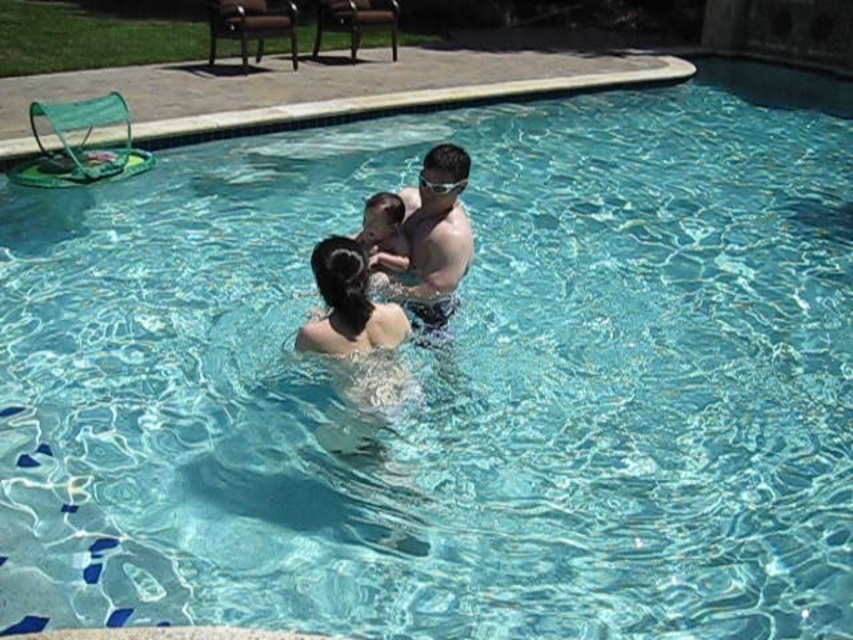
Based on the scene description, can you determine the position of the smooth skin man at center relative to the smooth skin child at center?

The smooth skin man at center is to the right of the smooth skin child at center.

You are a lifeguard on duty and notice the smooth skin child at center and the clear plastic goggles at upper center. According to safety protocols, the child must be within 10 inches of their goggles at all times. Is the child currently in compliance with this rule?

The smooth skin child at center is 13.43 inches away from the clear plastic goggles at upper center, which exceeds the 10 inch requirement. The child is not in compliance with the safety protocols.